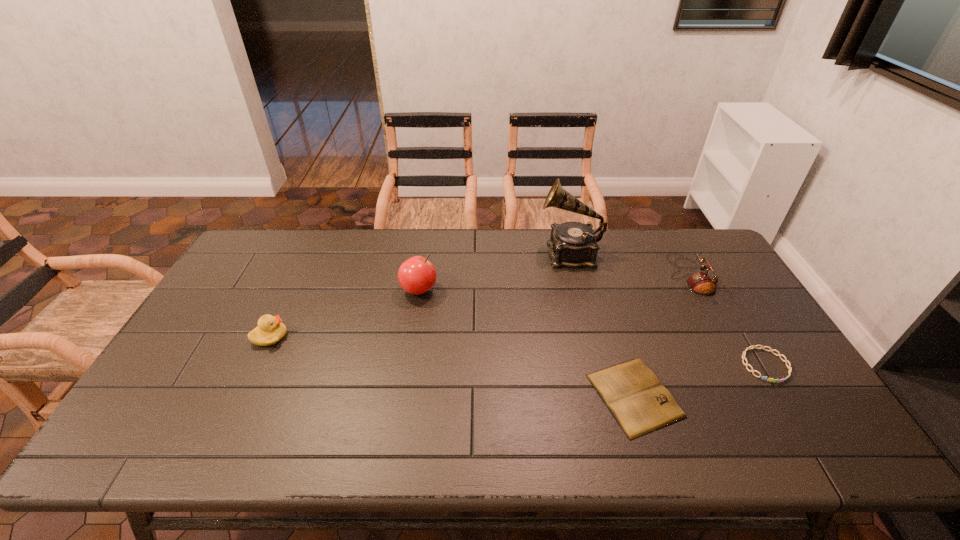
Image resolution: width=960 pixels, height=540 pixels. Identify the location of vacant space at the far right corner. (699, 241).

Identify the location of free space between the book and the third shortest object. (452, 366).

The image size is (960, 540). What are the coordinates of `free spot between the bracelet and the book` in the screenshot? It's located at (700, 380).

The height and width of the screenshot is (540, 960). Find the location of `vacant space that is in between the telephone and the duckling`. vacant space that is in between the telephone and the duckling is located at coordinates (480, 306).

Locate an element on the screen. This screenshot has width=960, height=540. vacant space in between the telephone and the second object from left to right is located at coordinates (554, 282).

Where is `vacant area that lies between the telephone and the apple`? vacant area that lies between the telephone and the apple is located at coordinates (554, 282).

At what (x,y) coordinates should I click in order to perform the action: click on free spot between the apple and the phonograph record. Please return your answer as a coordinate pair (x, y). This screenshot has width=960, height=540. Looking at the image, I should click on (494, 272).

I want to click on unoccupied position between the fifth object from right to left and the tallest object, so click(x=494, y=272).

Find the location of a particular element. free space between the book and the bracelet is located at coordinates (700, 380).

At what (x,y) coordinates should I click in order to perform the action: click on free space between the bracelet and the second tallest object. Please return your answer as a coordinate pair (x, y). This screenshot has height=540, width=960. Looking at the image, I should click on (592, 327).